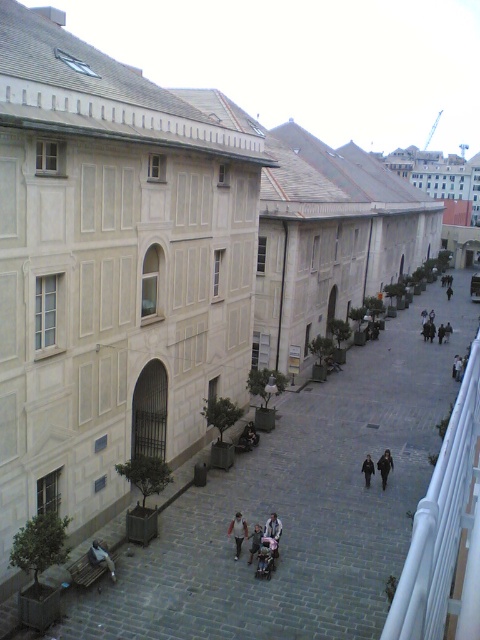
Find the location of `dark gray fabric jacket at center`. dark gray fabric jacket at center is located at coordinates (254, 541).

Can you confirm if light brown leather jacket at lower center is positioned to the left of dark gray fabric coat at center?

Correct, you'll find light brown leather jacket at lower center to the left of dark gray fabric coat at center.

Who is shorter, light brown leather jacket at lower center or dark gray fabric coat at center?

light brown leather jacket at lower center

You are a GUI agent. You are given a task and a screenshot of the screen. Output one action in this format:
    pyautogui.click(x=<x>, y=<y>)
    Task: Click on the light brown leather jacket at lower center
    
    Given the screenshot: What is the action you would take?
    pyautogui.click(x=100, y=557)

Describe the element at coordinates (100, 557) in the screenshot. I see `light brown leather jacket at lower center` at that location.

I want to click on light brown leather jacket at lower center, so click(100, 557).

Where is `light brown leather jacket at lower center`? The height and width of the screenshot is (640, 480). light brown leather jacket at lower center is located at coordinates (100, 557).